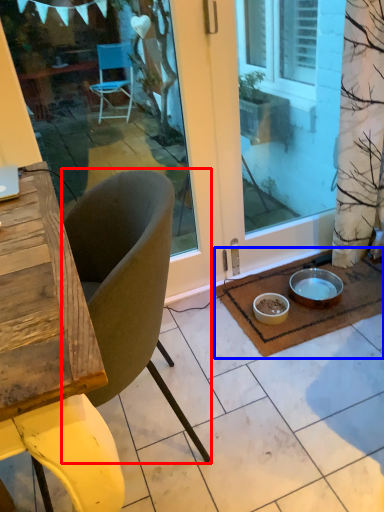
Question: Which object is closer to the camera taking this photo, chair (highlighted by a red box) or doormat (highlighted by a blue box)?

Choices:
 (A) chair
 (B) doormat

Answer: (A)